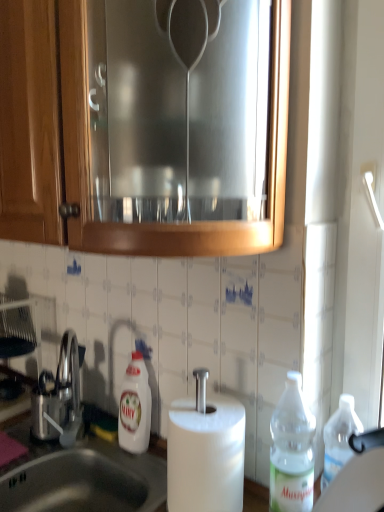
Measure the distance between point [134,6] and camera.

The distance of point [134,6] from camera is 27.60 inches.

This screenshot has height=512, width=384. In order to click on clear plastic bottle at right, which ranks as the 2th bottle in back-to-front order in this screenshot , I will do `click(292, 450)`.

Describe the element at coordinates (59, 397) in the screenshot. I see `satin nickel faucet at lower left` at that location.

Describe the element at coordinates (135, 407) in the screenshot. I see `white glossy bottle at lower center, which is counted as the first bottle, starting from the back` at that location.

This screenshot has height=512, width=384. Describe the element at coordinates (86, 481) in the screenshot. I see `satin silver sink at lower left` at that location.

The height and width of the screenshot is (512, 384). What are the coordinates of `brushed metal cabinet at upper center` in the screenshot? It's located at (146, 125).

Which of these two, brushed metal cabinet at upper center or satin silver sink at lower left, is bigger?

With larger size is brushed metal cabinet at upper center.

Is brushed metal cabinet at upper center to the left or to the right of satin silver sink at lower left in the image?

In the image, brushed metal cabinet at upper center appears on the left side of satin silver sink at lower left.

From the image's perspective, is brushed metal cabinet at upper center under satin silver sink at lower left?

No, from the image's perspective, brushed metal cabinet at upper center is not below satin silver sink at lower left.

From the image's perspective, which is above, brushed metal cabinet at upper center or clear plastic bottle at right, which appears as the 1th bottle when viewed from the right?

brushed metal cabinet at upper center.

Does brushed metal cabinet at upper center turn towards clear plastic bottle at right, which ranks as the 2th bottle in back-to-front order?

No, brushed metal cabinet at upper center is not turned towards clear plastic bottle at right, which ranks as the 2th bottle in back-to-front order.

Does brushed metal cabinet at upper center have a lesser height compared to clear plastic bottle at right, arranged as the 1th bottle when viewed from the front?

No, brushed metal cabinet at upper center is not shorter than clear plastic bottle at right, arranged as the 1th bottle when viewed from the front.

Is brushed metal cabinet at upper center at the back of clear plastic bottle at right, which appears as the 1th bottle when viewed from the right?

No, clear plastic bottle at right, which appears as the 1th bottle when viewed from the right,'s orientation is not away from brushed metal cabinet at upper center.

Is point (297, 376) in front of point (204, 181)?

No, (297, 376) is behind (204, 181).

How far apart are clear plastic bottle at right, which appears as the 1th bottle when viewed from the right, and brushed metal cabinet at upper center?

clear plastic bottle at right, which appears as the 1th bottle when viewed from the right, is 23.41 inches away from brushed metal cabinet at upper center.

Could brushed metal cabinet at upper center be considered to be inside clear plastic bottle at right, the 2th bottle from the left?

No, brushed metal cabinet at upper center is not surrounded by clear plastic bottle at right, the 2th bottle from the left.

Can you confirm if brushed metal cabinet at upper center is taller than white glossy bottle at lower center, the 2th bottle positioned from the right?

Correct, brushed metal cabinet at upper center is much taller as white glossy bottle at lower center, the 2th bottle positioned from the right.

From the image's perspective, is brushed metal cabinet at upper center located above or below white glossy bottle at lower center, the 2th bottle positioned from the right?

From the image's perspective, brushed metal cabinet at upper center appears above white glossy bottle at lower center, the 2th bottle positioned from the right.

Is brushed metal cabinet at upper center not within white glossy bottle at lower center, which is counted as the first bottle, starting from the back?

Yes, brushed metal cabinet at upper center is not within white glossy bottle at lower center, which is counted as the first bottle, starting from the back.

From the image's perspective, is white glossy bottle at lower center, which is counted as the first bottle, starting from the back, over satin silver sink at lower left?

Indeed, from the image's perspective, white glossy bottle at lower center, which is counted as the first bottle, starting from the back, is shown above satin silver sink at lower left.

What's the angular difference between white glossy bottle at lower center, which is counted as the first bottle, starting from the back, and satin silver sink at lower left's facing directions?

The angle between the facing direction of white glossy bottle at lower center, which is counted as the first bottle, starting from the back, and the facing direction of satin silver sink at lower left is 0.421 degrees.

Which is closer to the camera, (145, 378) or (63, 487)?

The point (145, 378) is in front.

Considering the relative sizes of white glossy bottle at lower center, the 2th bottle positioned from the right, and satin silver sink at lower left in the image provided, is white glossy bottle at lower center, the 2th bottle positioned from the right, bigger than satin silver sink at lower left?

Incorrect, white glossy bottle at lower center, the 2th bottle positioned from the right, is not larger than satin silver sink at lower left.

Based on the photo, from a real-world perspective, who is located lower, white glossy bottle at lower center, the first bottle from the left, or brushed metal cabinet at upper center?

white glossy bottle at lower center, the first bottle from the left, from a real-world perspective.

Does white glossy bottle at lower center, which is counted as the first bottle, starting from the back, have a greater height compared to brushed metal cabinet at upper center?

Incorrect, the height of white glossy bottle at lower center, which is counted as the first bottle, starting from the back, is not larger of that of brushed metal cabinet at upper center.

From the picture: How different are the orientations of white glossy bottle at lower center, the 2th bottle when ordered from front to back, and brushed metal cabinet at upper center in degrees?

The facing directions of white glossy bottle at lower center, the 2th bottle when ordered from front to back, and brushed metal cabinet at upper center are 0.421 degrees apart.

How distant is white glossy bottle at lower center, the 2th bottle when ordered from front to back, from brushed metal cabinet at upper center?

white glossy bottle at lower center, the 2th bottle when ordered from front to back, and brushed metal cabinet at upper center are 25.08 inches apart.

Identify the location of sink on the right side of satin nickel faucet at lower left. The image size is (384, 512). (86, 481).

Which object is closer to the camera taking this photo, satin nickel faucet at lower left or satin silver sink at lower left?

Positioned in front is satin silver sink at lower left.

Is satin nickel faucet at lower left looking in the opposite direction of satin silver sink at lower left?

No, satin nickel faucet at lower left is not facing the opposite direction of satin silver sink at lower left.

Which of these two, satin nickel faucet at lower left or satin silver sink at lower left, is bigger?

satin silver sink at lower left is bigger.

Identify the location of sink below the brushed metal cabinet at upper center (from a real-world perspective). (86, 481).

Where is `cabinetry located in front of the clear plastic bottle at right, arranged as the 1th bottle when viewed from the front`? The image size is (384, 512). cabinetry located in front of the clear plastic bottle at right, arranged as the 1th bottle when viewed from the front is located at coordinates (146, 125).

Estimate the real-world distances between objects in this image. Which object is further from clear plastic bottle at right, the 2th bottle from the left, satin silver sink at lower left or brushed metal cabinet at upper center?

brushed metal cabinet at upper center lies further to clear plastic bottle at right, the 2th bottle from the left, than the other object.

Estimate the real-world distances between objects in this image. Which object is further from white glossy bottle at lower center, the 2th bottle when ordered from front to back, satin nickel faucet at lower left or clear plastic bottle at right, arranged as the 1th bottle when viewed from the front?

clear plastic bottle at right, arranged as the 1th bottle when viewed from the front.

Looking at the image, which one is located further to brushed metal cabinet at upper center, satin silver sink at lower left or clear plastic bottle at right, which ranks as the 2th bottle in back-to-front order?

satin silver sink at lower left.

When comparing their distances from brushed metal cabinet at upper center, does satin silver sink at lower left or white glossy bottle at lower center, the 2th bottle positioned from the right, seem closer?

The object closer to brushed metal cabinet at upper center is white glossy bottle at lower center, the 2th bottle positioned from the right.

Considering their positions, is white glossy bottle at lower center, the 2th bottle positioned from the right, positioned further to clear plastic bottle at right, arranged as the 1th bottle when viewed from the front, than satin nickel faucet at lower left?

Based on the image, satin nickel faucet at lower left appears to be further to clear plastic bottle at right, arranged as the 1th bottle when viewed from the front.

Looking at the image, which one is located closer to satin nickel faucet at lower left, white glossy bottle at lower center, the first bottle from the left, or satin silver sink at lower left?

Based on the image, satin silver sink at lower left appears to be nearer to satin nickel faucet at lower left.

When comparing their distances from brushed metal cabinet at upper center, does clear plastic bottle at right, the 2th bottle from the left, or satin nickel faucet at lower left seem further?

Based on the image, satin nickel faucet at lower left appears to be further to brushed metal cabinet at upper center.

Estimate the real-world distances between objects in this image. Which object is further from brushed metal cabinet at upper center, satin silver sink at lower left or satin nickel faucet at lower left?

The object further to brushed metal cabinet at upper center is satin silver sink at lower left.

What are the coordinates of `sink situated between satin nickel faucet at lower left and clear plastic bottle at right, the 2th bottle from the left, from left to right` in the screenshot? It's located at (86, 481).

Locate an element on the screen. The image size is (384, 512). bottle located between satin nickel faucet at lower left and clear plastic bottle at right, the 2th bottle from the left, in the left-right direction is located at coordinates (135, 407).

You are a GUI agent. You are given a task and a screenshot of the screen. Output one action in this format:
    pyautogui.click(x=<x>, y=<y>)
    Task: Click on the tap between brushed metal cabinet at upper center and satin silver sink at lower left vertically
    The width and height of the screenshot is (384, 512).
    Given the screenshot: What is the action you would take?
    pyautogui.click(x=59, y=397)

Where is `tap between brushed metal cabinet at upper center and white glossy bottle at lower center, the 2th bottle when ordered from front to back, in the up-down direction`? This screenshot has height=512, width=384. tap between brushed metal cabinet at upper center and white glossy bottle at lower center, the 2th bottle when ordered from front to back, in the up-down direction is located at coordinates (59, 397).